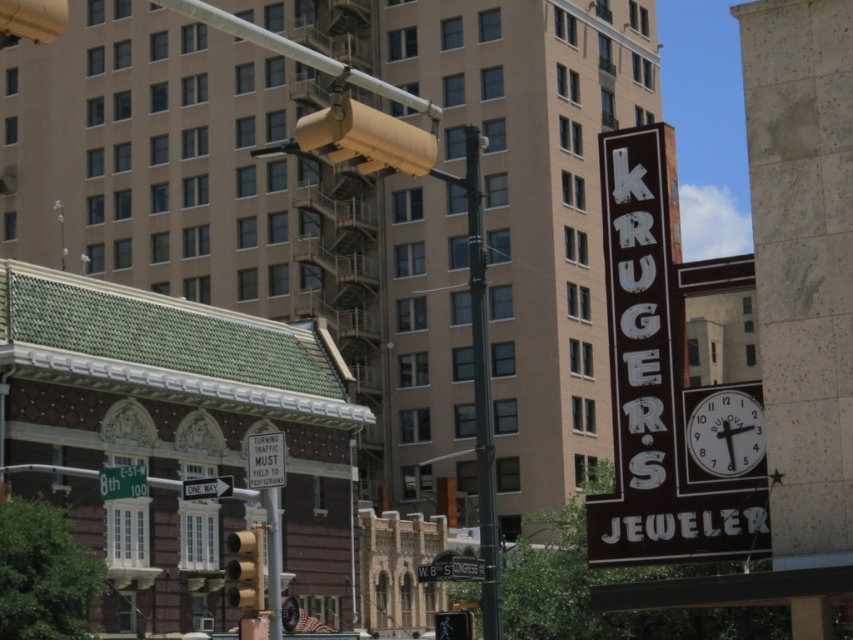
Question: Does white glossy clock at right have a larger size compared to white plastic sign at center?

Choices:
 (A) no
 (B) yes

Answer: (A)

Question: Which point is closer to the camera?

Choices:
 (A) white plastic one way sign at lower left
 (B) matte yellow traffic light at lower center
 (C) white glossy clock at right

Answer: (C)

Question: Estimate the real-world distances between objects in this image. Which object is closer to the metallic gray street sign at lower center?

Choices:
 (A) white plastic sign at center
 (B) metallic yellow traffic light at center

Answer: (B)

Question: Based on their relative distances, which object is nearer to the white glossy clock at right?

Choices:
 (A) white plastic one way sign at lower left
 (B) metallic yellow traffic light at center
 (C) black metal pole at center
 (D) yellow matte traffic light at center

Answer: (C)

Question: Can you confirm if white glossy clock at right is thinner than green matte street sign at lower left?

Choices:
 (A) yes
 (B) no

Answer: (A)

Question: Does yellow matte traffic light at center have a smaller size compared to green matte street sign at lower left?

Choices:
 (A) yes
 (B) no

Answer: (B)